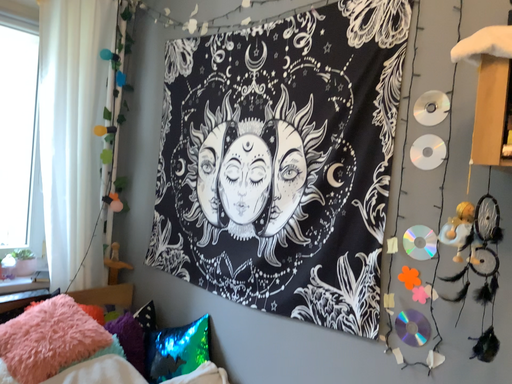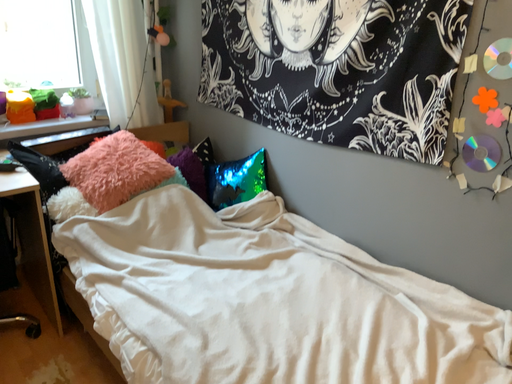
Question: How did the camera likely rotate when shooting the video?

Choices:
 (A) rotated upward
 (B) rotated downward

Answer: (B)